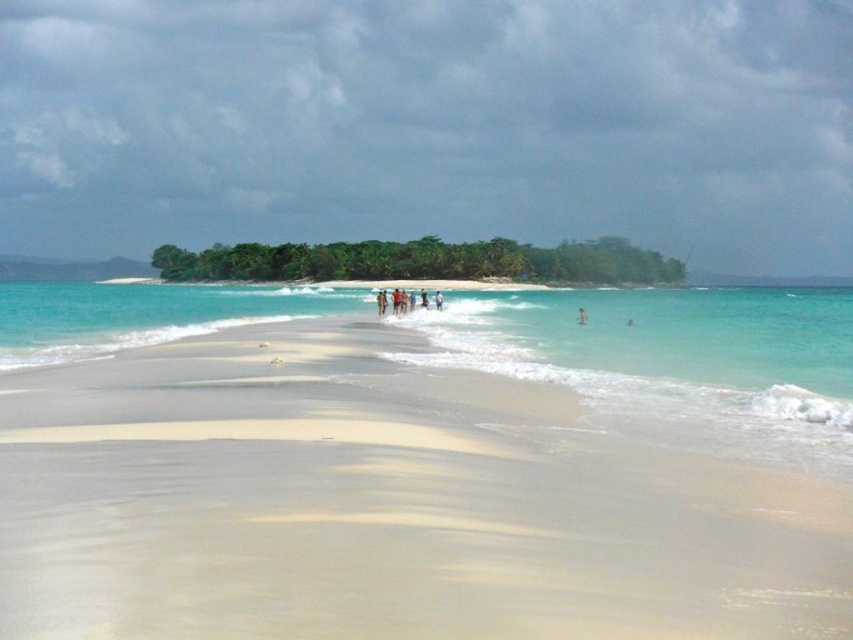
Between point (285, 552) and point (582, 307), which one is positioned behind?

The point (582, 307) is behind.

Who is taller, white sand beach at center or skinny person at center?

white sand beach at center

Between point (44, 611) and point (581, 321), which one is positioned behind?

Positioned behind is point (581, 321).

Find the location of `white sand beach at center`. white sand beach at center is located at coordinates (422, 467).

Does green leafy island at center come behind skinny person at center?

Yes, green leafy island at center is further from the viewer.

Between green leafy island at center and skinny person at center, which one appears on the left side from the viewer's perspective?

Positioned to the left is green leafy island at center.

In order to click on green leafy island at center in this screenshot , I will do `click(422, 260)`.

Who is more forward, (405,472) or (167,280)?

Point (405,472) is more forward.

Is white sand beach at center closer to camera compared to green leafy island at center?

That is True.

The height and width of the screenshot is (640, 853). Describe the element at coordinates (422, 467) in the screenshot. I see `white sand beach at center` at that location.

Locate an element on the screen. The width and height of the screenshot is (853, 640). white sand beach at center is located at coordinates (422, 467).